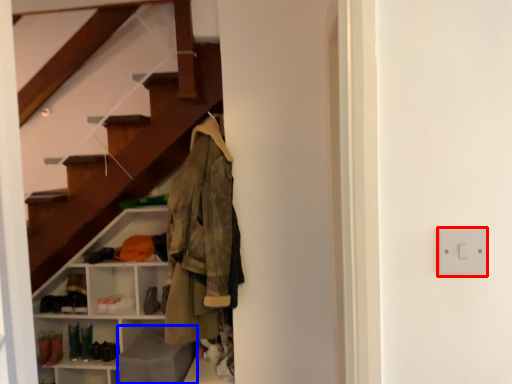
Question: Which of the following is the farthest to the observer, electric outlet (highlighted by a red box) or gray (highlighted by a blue box)?

Choices:
 (A) electric outlet
 (B) gray

Answer: (B)